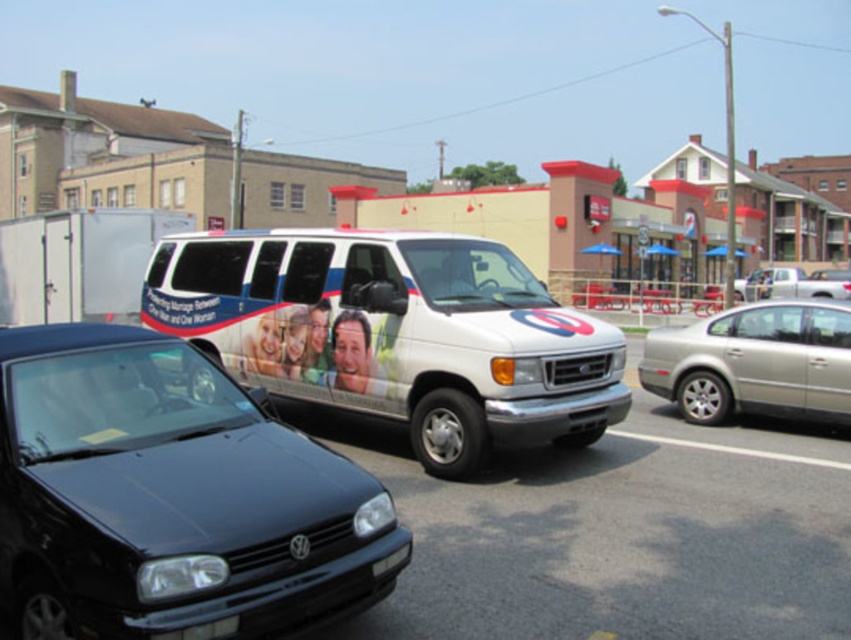
You are a delivery driver who needs to park your vehicle between the black matte hatchback at lower left and the silver metallic sedan at right. Your vehicle is 4.5 meters long. Can you fit your vehicle in the available space between them?

The black matte hatchback at lower left is smaller than the silver metallic sedan at right, but the exact distance between them isn not provided. Without knowing the space between the two vehicles, it is impossible to determine if your 4.5 meter vehicle can fit.

You are a pedestrian standing in the middle of the street. You see a white glossy van at center and a silver metallic sedan at right. Which vehicle is nearer to you?

The white glossy van at center is closer to the viewer than the silver metallic sedan at right, so the white glossy van at center is nearer to you.

You are standing at the center of the street. There is a point at coordinates point (395, 333). What object is located at that point?

The point (395, 333) indicates the white glossy van at center.